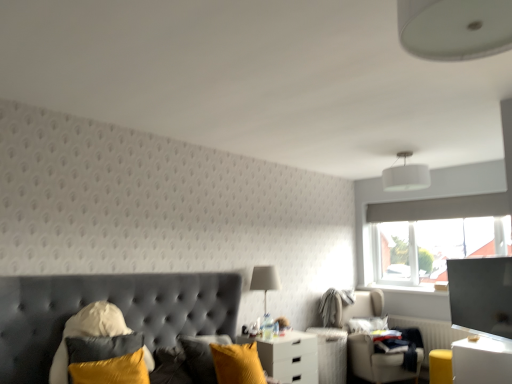
Identify the location of white glossy nightstand at lower right, the 1th nightstand positioned from the right. (482, 361).

The height and width of the screenshot is (384, 512). What do you see at coordinates (482, 361) in the screenshot? I see `white glossy nightstand at lower right, the second nightstand from the left` at bounding box center [482, 361].

What do you see at coordinates (288, 356) in the screenshot? This screenshot has height=384, width=512. I see `white glossy nightstand at center, which is the first nightstand in back-to-front order` at bounding box center [288, 356].

What are the coordinates of `soft white pillow at lower right, the 2th pillow viewed from the left` in the screenshot? It's located at (367, 324).

Can we say white glossy nightstand at center, which is counted as the 2th nightstand, starting from the right, lies outside soft white pillow at lower right, which appears as the 1th pillow when viewed from the right?

Yes, white glossy nightstand at center, which is counted as the 2th nightstand, starting from the right, is located beyond the bounds of soft white pillow at lower right, which appears as the 1th pillow when viewed from the right.

Between white glossy nightstand at center, which is counted as the 2th nightstand, starting from the right, and soft white pillow at lower right, positioned as the second pillow in top-to-bottom order, which one is positioned behind?

soft white pillow at lower right, positioned as the second pillow in top-to-bottom order, is further away from the camera.

Consider the image. Is there a large distance between white glossy nightstand at center, which is the first nightstand in back-to-front order, and soft white pillow at lower right, the 2th pillow viewed from the left?

Yes.

Which object is closer to the camera taking this photo, beige fabric swivel chair at lower right or white glossy nightstand at center, positioned as the 1th nightstand in left-to-right order?

white glossy nightstand at center, positioned as the 1th nightstand in left-to-right order, is in front.

Would you say beige fabric swivel chair at lower right is inside or outside white glossy nightstand at center, which is counted as the 2th nightstand, starting from the right?

The correct answer is: outside.

Considering the relative sizes of beige fabric swivel chair at lower right and white glossy nightstand at center, which is counted as the 2th nightstand, starting from the right, in the image provided, is beige fabric swivel chair at lower right thinner than white glossy nightstand at center, which is counted as the 2th nightstand, starting from the right,?

No.

Is white glossy nightstand at center, positioned as the 1th nightstand in left-to-right order, looking in the opposite direction of white fabric lampshade at upper center?

That's not correct — white glossy nightstand at center, positioned as the 1th nightstand in left-to-right order, is not looking away from white fabric lampshade at upper center.

Is white glossy nightstand at center, the second nightstand viewed from the front, wider or thinner than white fabric lampshade at upper center?

In the image, white glossy nightstand at center, the second nightstand viewed from the front, appears to be wider than white fabric lampshade at upper center.

Does white glossy nightstand at center, which is the first nightstand in back-to-front order, have a greater height compared to white fabric lampshade at upper center?

Yes, white glossy nightstand at center, which is the first nightstand in back-to-front order, is taller than white fabric lampshade at upper center.

Who is bigger, white glossy nightstand at center, positioned as the 1th nightstand in left-to-right order, or white fabric lampshade at upper center?

Bigger between the two is white glossy nightstand at center, positioned as the 1th nightstand in left-to-right order.

Is beige fabric swivel chair at lower right touching white fabric lampshade at upper center?

There is a gap between beige fabric swivel chair at lower right and white fabric lampshade at upper center.

Considering the relative sizes of beige fabric swivel chair at lower right and white fabric lampshade at upper center in the image provided, is beige fabric swivel chair at lower right shorter than white fabric lampshade at upper center?

In fact, beige fabric swivel chair at lower right may be taller than white fabric lampshade at upper center.

Does beige fabric swivel chair at lower right come behind white fabric lampshade at upper center?

Yes.

From the image's perspective, which one is positioned higher, beige fabric swivel chair at lower right or white fabric lampshade at upper center?

white fabric lampshade at upper center is shown above in the image.

Can you confirm if soft white pillow at lower right, which appears as the 1th pillow when viewed from the right, is smaller than white glossy nightstand at center, positioned as the 1th nightstand in left-to-right order?

Correct, soft white pillow at lower right, which appears as the 1th pillow when viewed from the right, occupies less space than white glossy nightstand at center, positioned as the 1th nightstand in left-to-right order.

Is soft white pillow at lower right, positioned as the second pillow in top-to-bottom order, taller or shorter than white glossy nightstand at center, the second nightstand viewed from the front?

In the image, soft white pillow at lower right, positioned as the second pillow in top-to-bottom order, appears to be shorter than white glossy nightstand at center, the second nightstand viewed from the front.

From a real-world perspective, which object rests below the other?

white glossy nightstand at center, which is the first nightstand in back-to-front order, is physically lower.

In the scene shown: Between beige fabric swivel chair at lower right and velvet yellow pillow at lower left, the 2th pillow in the back-to-front sequence, which one has less height?

With less height is velvet yellow pillow at lower left, the 2th pillow in the back-to-front sequence.

Does beige fabric swivel chair at lower right have a larger size compared to velvet yellow pillow at lower left, which is the 1th pillow from front to back?

Correct, beige fabric swivel chair at lower right is larger in size than velvet yellow pillow at lower left, which is the 1th pillow from front to back.

In the scene shown: Considering the relative positions of beige fabric swivel chair at lower right and velvet yellow pillow at lower left, the 2th pillow in the back-to-front sequence, in the image provided, is beige fabric swivel chair at lower right to the right of velvet yellow pillow at lower left, the 2th pillow in the back-to-front sequence, from the viewer's perspective?

Yes, beige fabric swivel chair at lower right is to the right of velvet yellow pillow at lower left, the 2th pillow in the back-to-front sequence.

Is beige fabric swivel chair at lower right facing away from velvet yellow pillow at lower left, the second pillow ordered from the bottom?

That's not correct — beige fabric swivel chair at lower right is not looking away from velvet yellow pillow at lower left, the second pillow ordered from the bottom.

Does matte white table lamp at center contain white fabric lampshade at upper center?

No, white fabric lampshade at upper center is not surrounded by matte white table lamp at center.

Between matte white table lamp at center and white fabric lampshade at upper center, which one has smaller width?

matte white table lamp at center.

Is matte white table lamp at center facing away from white fabric lampshade at upper center?

No, white fabric lampshade at upper center is not at the back of matte white table lamp at center.

Where is `the 2nd nightstand below the soft white pillow at lower right, which appears as the 1th pillow when viewed from the right (from a real-world perspective)`? The width and height of the screenshot is (512, 384). the 2nd nightstand below the soft white pillow at lower right, which appears as the 1th pillow when viewed from the right (from a real-world perspective) is located at coordinates (288, 356).

Locate an element on the screen. The height and width of the screenshot is (384, 512). swivel chair above the white glossy nightstand at center, the second nightstand viewed from the front (from a real-world perspective) is located at coordinates (378, 362).

Which object lies nearer to the anchor point beige fabric swivel chair at lower right, white fabric lampshade at upper center or white glossy nightstand at center, positioned as the 1th nightstand in left-to-right order?

white glossy nightstand at center, positioned as the 1th nightstand in left-to-right order, is closer to beige fabric swivel chair at lower right.

Based on the photo, based on their spatial positions, is white fabric lampshade at upper center or white glossy nightstand at center, which is counted as the 2th nightstand, starting from the right, further from velvet yellow pillow at lower left, which is the 1th pillow from front to back?

Among the two, white fabric lampshade at upper center is located further to velvet yellow pillow at lower left, which is the 1th pillow from front to back.

Considering their positions, is white glossy nightstand at center, positioned as the 1th nightstand in left-to-right order, positioned closer to beige fabric swivel chair at lower right than velvet yellow pillow at lower left, which is the 1th pillow from front to back?

Among the two, white glossy nightstand at center, positioned as the 1th nightstand in left-to-right order, is located nearer to beige fabric swivel chair at lower right.

Estimate the real-world distances between objects in this image. Which object is further from white glossy nightstand at lower right, the second nightstand from the left, white glossy nightstand at center, which is the first nightstand in back-to-front order, or velvet yellow pillow at lower left, which is the 1th pillow from left to right?

The object further to white glossy nightstand at lower right, the second nightstand from the left, is velvet yellow pillow at lower left, which is the 1th pillow from left to right.

Which object lies nearer to the anchor point white glossy nightstand at center, which is counted as the 2th nightstand, starting from the right, velvet yellow pillow at lower left, the 2th pillow in the back-to-front sequence, or beige fabric swivel chair at lower right?

beige fabric swivel chair at lower right lies closer to white glossy nightstand at center, which is counted as the 2th nightstand, starting from the right, than the other object.

Considering their positions, is soft white pillow at lower right, positioned as the second pillow in top-to-bottom order, positioned further to white glossy nightstand at lower right, the 1th nightstand positioned from the right, than beige fabric swivel chair at lower right?

soft white pillow at lower right, positioned as the second pillow in top-to-bottom order, is further to white glossy nightstand at lower right, the 1th nightstand positioned from the right.

When comparing their distances from velvet yellow pillow at lower left, positioned as the first pillow in top-to-bottom order, does matte white table lamp at center or soft white pillow at lower right, the 2th pillow viewed from the left, seem further?

soft white pillow at lower right, the 2th pillow viewed from the left, is positioned further to the anchor velvet yellow pillow at lower left, positioned as the first pillow in top-to-bottom order.

Looking at this image, looking at the image, which one is located closer to white fabric lampshade at upper center, white glossy nightstand at center, the second nightstand viewed from the front, or soft white pillow at lower right, which appears as the 1th pillow when viewed from the right?

soft white pillow at lower right, which appears as the 1th pillow when viewed from the right.

Find the location of `pillow located between matte white table lamp at center and beige fabric swivel chair at lower right in the left-right direction`. pillow located between matte white table lamp at center and beige fabric swivel chair at lower right in the left-right direction is located at coordinates (367, 324).

Where is `nightstand located between velvet yellow pillow at lower left, which is the 1th pillow from left to right, and white glossy nightstand at lower right, which is counted as the 1th nightstand, starting from the front, in the left-right direction`? The image size is (512, 384). nightstand located between velvet yellow pillow at lower left, which is the 1th pillow from left to right, and white glossy nightstand at lower right, which is counted as the 1th nightstand, starting from the front, in the left-right direction is located at coordinates (288, 356).

Identify the location of nightstand between white fabric lampshade at upper center and beige fabric swivel chair at lower right in the up-down direction. This screenshot has height=384, width=512. (482, 361).

Locate an element on the screen. swivel chair between velvet yellow pillow at lower left, which is the 1th pillow from front to back, and white glossy nightstand at lower right, which is counted as the 1th nightstand, starting from the front is located at coordinates (378, 362).